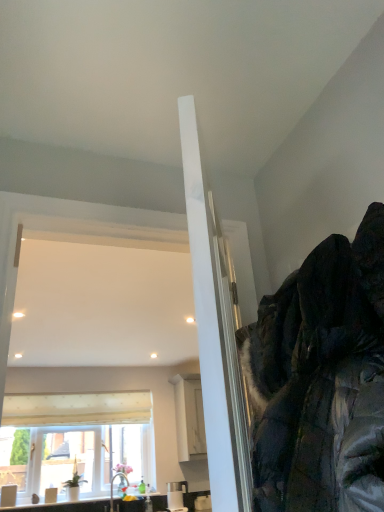
Question: Is dark green textured jacket at upper right to the left of matte white sink at lower left, acting as the first sink starting from the right, from the viewer's perspective?

Choices:
 (A) no
 (B) yes

Answer: (A)

Question: From the image's perspective, is dark green textured jacket at upper right on matte white sink at lower left, which is counted as the 2th sink, starting from the left?

Choices:
 (A) no
 (B) yes

Answer: (B)

Question: Considering the relative sizes of dark green textured jacket at upper right and matte white sink at lower left, which is counted as the 2th sink, starting from the left, in the image provided, is dark green textured jacket at upper right shorter than matte white sink at lower left, which is counted as the 2th sink, starting from the left,?

Choices:
 (A) no
 (B) yes

Answer: (A)

Question: Does dark green textured jacket at upper right have a greater height compared to matte white sink at lower left, acting as the first sink starting from the right?

Choices:
 (A) no
 (B) yes

Answer: (B)

Question: Is dark green textured jacket at upper right thinner than matte white sink at lower left, acting as the first sink starting from the right?

Choices:
 (A) no
 (B) yes

Answer: (A)

Question: Considering the positions of white textured curtain at lower left and white textured window at center in the image, is white textured curtain at lower left wider or thinner than white textured window at center?

Choices:
 (A) thin
 (B) wide

Answer: (A)

Question: Would you say white textured curtain at lower left is to the left or to the right of white textured window at center in the picture?

Choices:
 (A) left
 (B) right

Answer: (B)

Question: Looking at the image, does white textured curtain at lower left seem bigger or smaller compared to white textured window at center?

Choices:
 (A) small
 (B) big

Answer: (A)

Question: In the image, is white textured curtain at lower left positioned in front of or behind white textured window at center?

Choices:
 (A) front
 (B) behind

Answer: (B)

Question: Relative to white textured curtain at lower left, is white textured window at center in front or behind?

Choices:
 (A) behind
 (B) front

Answer: (B)

Question: Is white textured window at center inside or outside of white textured curtain at lower left?

Choices:
 (A) inside
 (B) outside

Answer: (B)

Question: From a real-world perspective, relative to white textured curtain at lower left, is white textured window at center vertically above or below?

Choices:
 (A) below
 (B) above

Answer: (A)

Question: Does point (102, 471) appear closer or farther from the camera than point (34, 417)?

Choices:
 (A) farther
 (B) closer

Answer: (A)

Question: Visually, is white textured curtain at lower left positioned to the left or to the right of dark green textured jacket at upper right?

Choices:
 (A) left
 (B) right

Answer: (A)

Question: Considering their positions, is white textured curtain at lower left located in front of or behind dark green textured jacket at upper right?

Choices:
 (A) front
 (B) behind

Answer: (B)